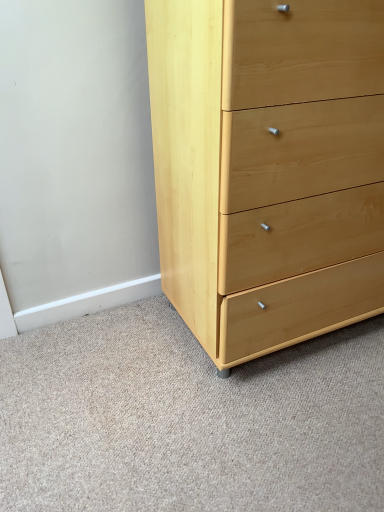
Where is `vacant space in front of natural wood chest of drawers at center`? The width and height of the screenshot is (384, 512). vacant space in front of natural wood chest of drawers at center is located at coordinates (279, 419).